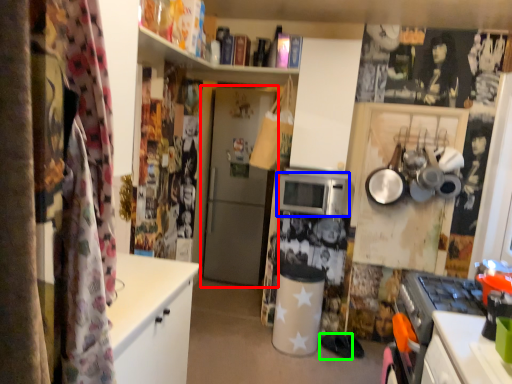
Question: Based on their relative distances, which object is nearer to door (highlighted by a red box)? Choose from microwave oven (highlighted by a blue box) and footwear (highlighted by a green box).

Choices:
 (A) microwave oven
 (B) footwear

Answer: (A)